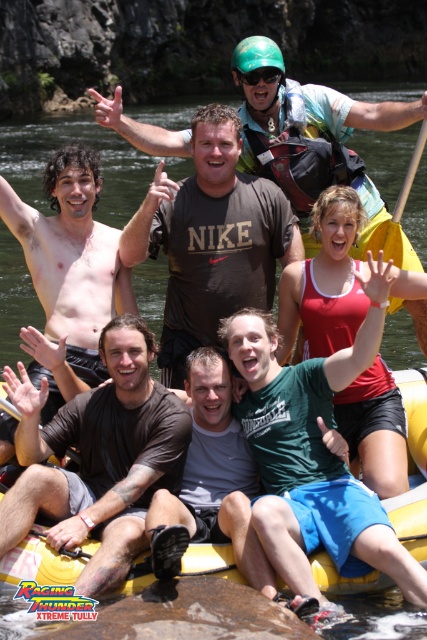
Question: Does green cotton shirt at center appear over dark brown cotton t-shirt at center?

Choices:
 (A) yes
 (B) no

Answer: (B)

Question: Does dark brown cotton t-shirt at center have a smaller size compared to red matte tank top at center?

Choices:
 (A) no
 (B) yes

Answer: (A)

Question: Can you confirm if green cotton shirt at center is positioned to the left of yellow rubber raft at lower center?

Choices:
 (A) yes
 (B) no

Answer: (B)

Question: Among these objects, which one is farthest from the camera?

Choices:
 (A) brown cotton t-shirt at center
 (B) yellow rubber raft at lower center

Answer: (A)

Question: Which point appears farthest from the camera in this image?

Choices:
 (A) (160, 177)
 (B) (99, 556)
 (C) (400, 621)
 (D) (318, 593)

Answer: (A)

Question: Which of the following is the closest to the observer?

Choices:
 (A) red matte tank top at center
 (B) green cotton shirt at center
 (C) dark brown cotton t-shirt at center
 (D) brown cotton t-shirt at center

Answer: (D)